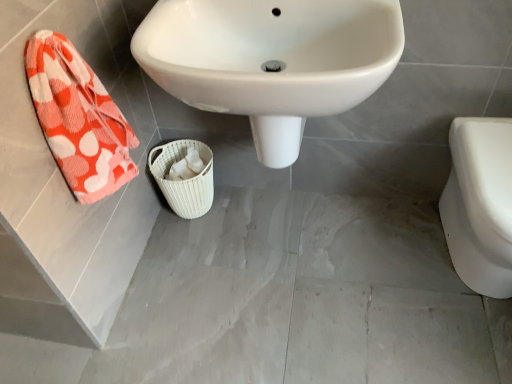
Question: From a real-world perspective, is white glossy sink at center located beneath white glossy toilet at right?

Choices:
 (A) no
 (B) yes

Answer: (A)

Question: From a real-world perspective, is white glossy sink at center located higher than white glossy toilet at right?

Choices:
 (A) yes
 (B) no

Answer: (A)

Question: Does white glossy sink at center lie behind white glossy toilet at right?

Choices:
 (A) no
 (B) yes

Answer: (A)

Question: Is white glossy sink at center completely or partially outside of white glossy toilet at right?

Choices:
 (A) yes
 (B) no

Answer: (A)

Question: From the image's perspective, is white glossy sink at center under white glossy toilet at right?

Choices:
 (A) yes
 (B) no

Answer: (B)

Question: Is point (88, 182) closer or farther from the camera than point (238, 38)?

Choices:
 (A) closer
 (B) farther

Answer: (A)

Question: From a real-world perspective, is orange-patterned towel at left physically located above or below white glossy sink at center?

Choices:
 (A) below
 (B) above

Answer: (B)

Question: From the image's perspective, relative to white glossy sink at center, is orange-patterned towel at left above or below?

Choices:
 (A) above
 (B) below

Answer: (B)

Question: Considering the positions of orange-patterned towel at left and white glossy sink at center in the image, is orange-patterned towel at left wider or thinner than white glossy sink at center?

Choices:
 (A) thin
 (B) wide

Answer: (A)

Question: Looking at the image, does white woven basket at center seem bigger or smaller compared to orange-patterned towel at left?

Choices:
 (A) big
 (B) small

Answer: (A)

Question: Is white woven basket at center in front of or behind orange-patterned towel at left in the image?

Choices:
 (A) front
 (B) behind

Answer: (B)

Question: Is white woven basket at center taller or shorter than orange-patterned towel at left?

Choices:
 (A) short
 (B) tall

Answer: (A)

Question: Visually, is white woven basket at center positioned to the left or to the right of orange-patterned towel at left?

Choices:
 (A) left
 (B) right

Answer: (B)

Question: From the image's perspective, relative to white woven basket at center, is white glossy sink at center above or below?

Choices:
 (A) below
 (B) above

Answer: (B)

Question: In terms of height, does white glossy sink at center look taller or shorter compared to white woven basket at center?

Choices:
 (A) short
 (B) tall

Answer: (B)